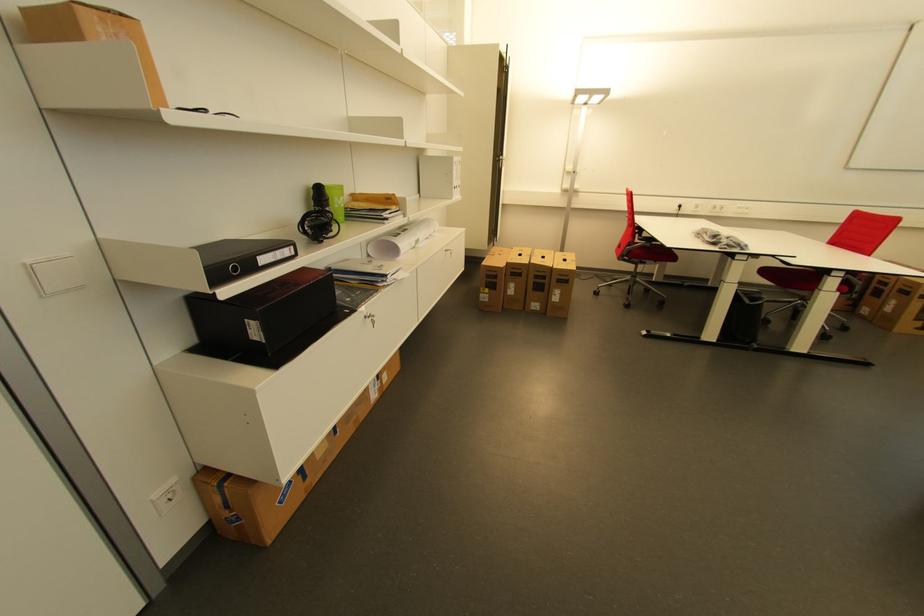
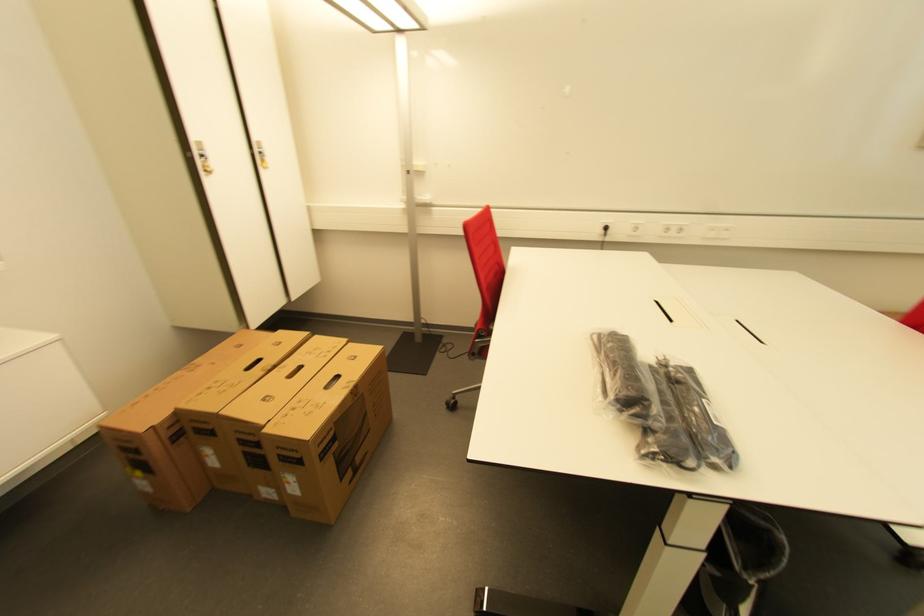
In a continuous first-person perspective shot, in which direction is the camera moving?

The cameraman moved toward right, forward.